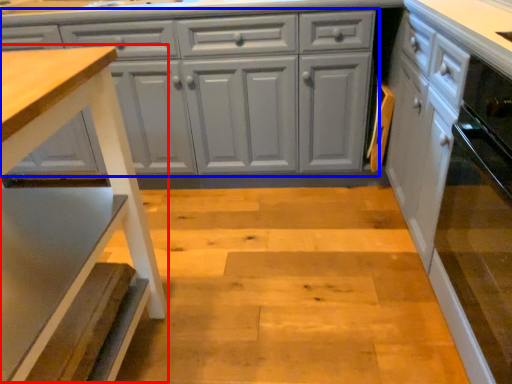
Question: Which point is further to the camera, step stool (highlighted by a red box) or cabinetry (highlighted by a blue box)?

Choices:
 (A) step stool
 (B) cabinetry

Answer: (B)